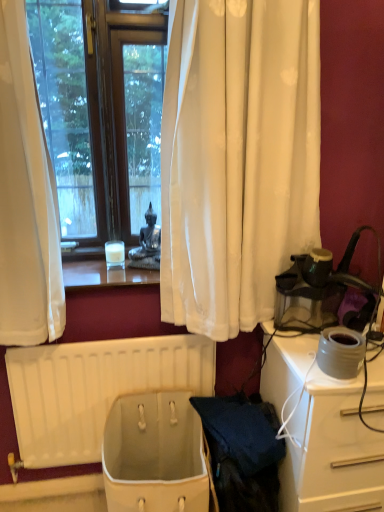
This screenshot has width=384, height=512. Find the location of `vacant point to the left of matte gray pot at right`. vacant point to the left of matte gray pot at right is located at coordinates (302, 367).